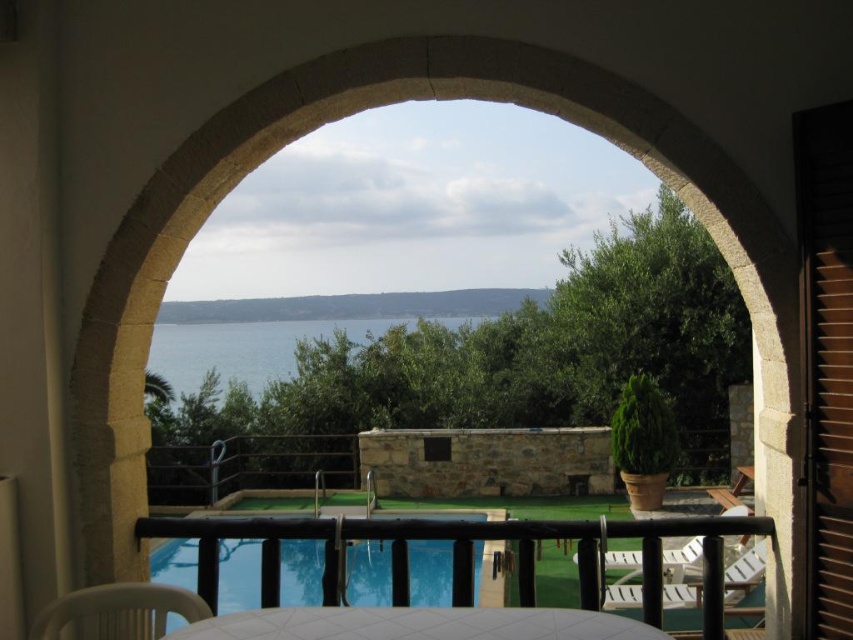
You are standing in front of the arched stone doorway and want to know if the transparent glass pool at center is taller than the blue water at center. Can you confirm this based on the scene?

The transparent glass pool at center has a greater height compared to blue water at center, so yes, the transparent glass pool at center is taller than the blue water at center.

You are standing in front of the arched stone doorway and want to walk to the transparent glass pool at center. According to the coordinates provided, is the pool closer to the doorway or further away?

The transparent glass pool at center is located at point 0.897 on the x and 0.280 on the y axis. Since the coordinates are given without context, we can infer that the pool is positioned towards the center of the image, but without additional spatial reference points, it is impossible to determine if it is closer to the doorway or further away based solely on the provided information.